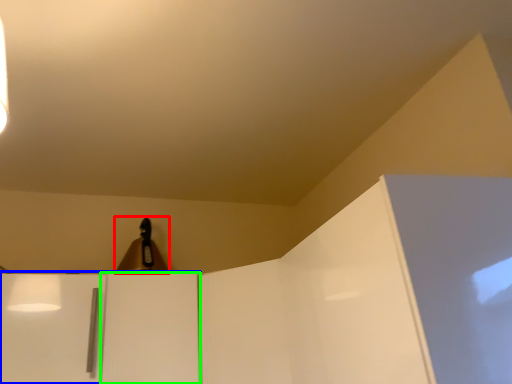
Question: Considering the real-world distances, which object is farthest from lamp (highlighted by a red box)? cabinetry (highlighted by a blue box) or door (highlighted by a green box)?

Choices:
 (A) cabinetry
 (B) door

Answer: (A)